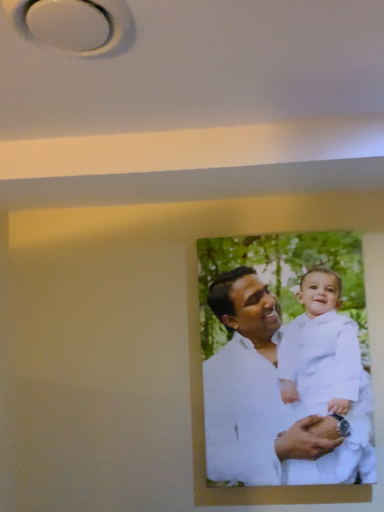
This screenshot has height=512, width=384. What are the coordinates of `white cotton portrait at center` in the screenshot? It's located at (244, 423).

What is the approximate height of white cotton portrait at center?

white cotton portrait at center is 29.78 inches tall.

Describe the element at coordinates (244, 423) in the screenshot. Image resolution: width=384 pixels, height=512 pixels. I see `white cotton portrait at center` at that location.

I want to click on white cotton portrait at center, so click(x=244, y=423).